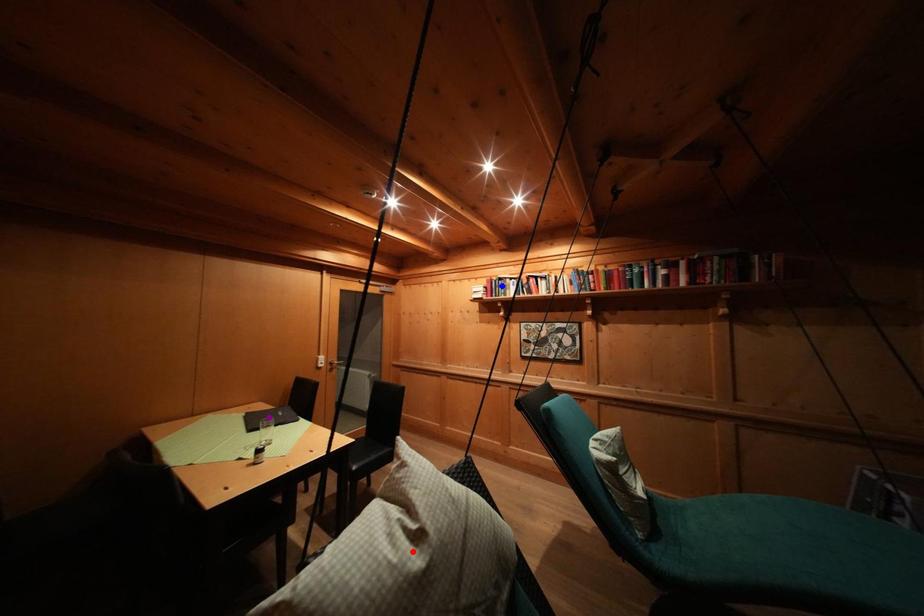
Consider the image. Order these from nearest to farthest:
A) red point
B) blue point
C) purple point

1. red point
2. purple point
3. blue point